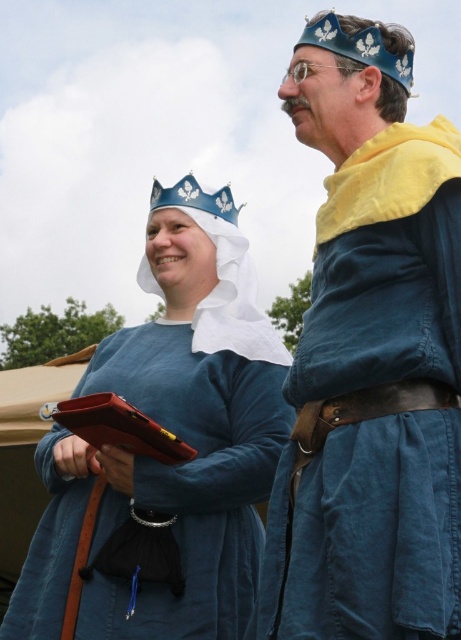
Question: Does blue linen tunic at center have a greater width compared to white fabric headdress at center?

Choices:
 (A) no
 (B) yes

Answer: (B)

Question: Which of the following is the farthest from the observer?

Choices:
 (A) white fabric headdress at center
 (B) blue metallic crown at upper center
 (C) blue linen dress at center
 (D) blue linen tunic at center

Answer: (A)

Question: Estimate the real-world distances between objects in this image. Which object is closer to the blue linen tunic at center?

Choices:
 (A) blue linen dress at center
 (B) white fabric headdress at center

Answer: (A)

Question: Is white fabric headdress at center wider than blue metallic crown at upper center?

Choices:
 (A) no
 (B) yes

Answer: (A)

Question: Can you confirm if blue linen tunic at center is positioned to the right of white fabric headdress at center?

Choices:
 (A) yes
 (B) no

Answer: (A)

Question: Based on their relative distances, which object is nearer to the blue metallic crown at upper center?

Choices:
 (A) white fabric headdress at center
 (B) blue linen dress at center
 (C) blue linen tunic at center

Answer: (A)